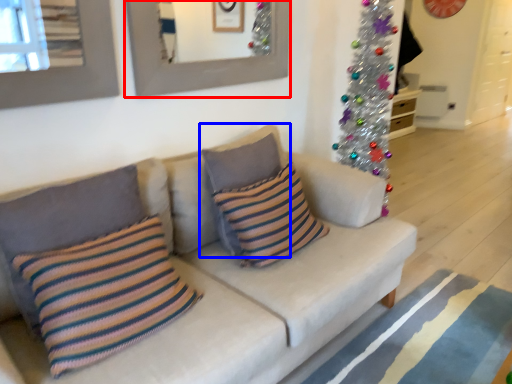
Question: Which object appears farthest to the camera in this image, picture frame (highlighted by a red box) or pillow (highlighted by a blue box)?

Choices:
 (A) picture frame
 (B) pillow

Answer: (A)